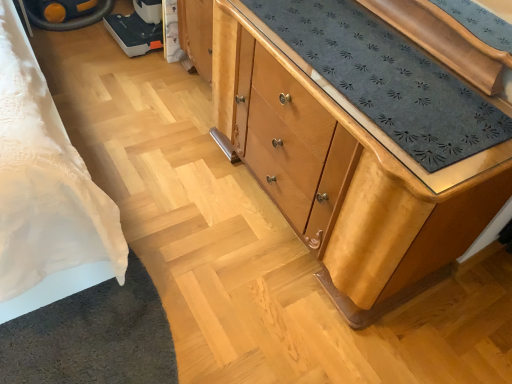
Question: Considering the positions of yellow rubber wheel at upper left and light brown wood chest of drawers at center in the image, is yellow rubber wheel at upper left wider or thinner than light brown wood chest of drawers at center?

Choices:
 (A) wide
 (B) thin

Answer: (A)

Question: Would you say yellow rubber wheel at upper left is inside or outside light brown wood chest of drawers at center?

Choices:
 (A) inside
 (B) outside

Answer: (B)

Question: From the image's perspective, is yellow rubber wheel at upper left located above or below light brown wood chest of drawers at center?

Choices:
 (A) above
 (B) below

Answer: (A)

Question: Based on their sizes in the image, would you say light brown wood chest of drawers at center is bigger or smaller than yellow rubber wheel at upper left?

Choices:
 (A) small
 (B) big

Answer: (B)

Question: Do you think light brown wood chest of drawers at center is within yellow rubber wheel at upper left, or outside of it?

Choices:
 (A) inside
 (B) outside

Answer: (B)

Question: Would you say light brown wood chest of drawers at center is to the left or to the right of yellow rubber wheel at upper left in the picture?

Choices:
 (A) right
 (B) left

Answer: (A)

Question: Considering the positions of light brown wood chest of drawers at center and yellow rubber wheel at upper left in the image, is light brown wood chest of drawers at center wider or thinner than yellow rubber wheel at upper left?

Choices:
 (A) thin
 (B) wide

Answer: (A)